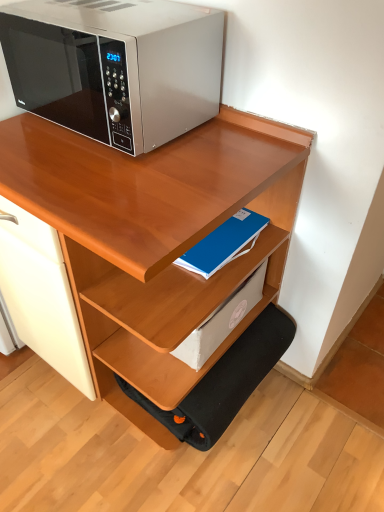
What is the approximate width of blue matte notebook at center, the 1th paperback book viewed from the top?

The width of blue matte notebook at center, the 1th paperback book viewed from the top, is 13.20 inches.

What do you see at coordinates (225, 381) in the screenshot? This screenshot has width=384, height=512. I see `black fabric step stool at lower center` at bounding box center [225, 381].

At what (x,y) coordinates should I click in order to perform the action: click on black fabric step stool at lower center. Please return your answer as a coordinate pair (x, y). This screenshot has height=512, width=384. Looking at the image, I should click on (225, 381).

What is the approximate width of wooden desk at upper center?

Answer: wooden desk at upper center is 24.09 inches wide.

Where is `blue matte paper at center, acting as the 1th paperback book starting from the bottom`? The height and width of the screenshot is (512, 384). blue matte paper at center, acting as the 1th paperback book starting from the bottom is located at coordinates (221, 321).

Which point is more distant from viewer, (259,381) or (118,203)?

The point (259,381) is farther.

Is black fabric step stool at lower center not near wooden desk at upper center?

No, black fabric step stool at lower center is in close proximity to wooden desk at upper center.

Consider the image. Considering the relative positions of black fabric step stool at lower center and wooden desk at upper center in the image provided, is black fabric step stool at lower center to the left of wooden desk at upper center from the viewer's perspective?

No, black fabric step stool at lower center is not to the left of wooden desk at upper center.

From the image's perspective, which one is positioned higher, blue matte notebook at center, the 1th paperback book viewed from the top, or satin silver microwave at upper left?

satin silver microwave at upper left is shown above in the image.

Considering the relative positions of blue matte notebook at center, positioned as the second paperback book in bottom-to-top order, and satin silver microwave at upper left in the image provided, is blue matte notebook at center, positioned as the second paperback book in bottom-to-top order, to the left of satin silver microwave at upper left from the viewer's perspective?

Incorrect, blue matte notebook at center, positioned as the second paperback book in bottom-to-top order, is not on the left side of satin silver microwave at upper left.

Is point (240, 217) behind point (208, 114)?

Yes.

From a real-world perspective, does blue matte notebook at center, positioned as the second paperback book in bottom-to-top order, sit lower than satin silver microwave at upper left?

Correct, in the physical world, blue matte notebook at center, positioned as the second paperback book in bottom-to-top order, is lower than satin silver microwave at upper left.

Do you think satin silver microwave at upper left is within black fabric step stool at lower center, or outside of it?

satin silver microwave at upper left is not enclosed by black fabric step stool at lower center.

From a real-world perspective, is satin silver microwave at upper left physically located above or below black fabric step stool at lower center?

Clearly, from a real-world perspective, satin silver microwave at upper left is above black fabric step stool at lower center.

Could you measure the distance between satin silver microwave at upper left and black fabric step stool at lower center?

satin silver microwave at upper left is 30.51 inches from black fabric step stool at lower center.

Is satin silver microwave at upper left facing towards black fabric step stool at lower center?

No, satin silver microwave at upper left does not turn towards black fabric step stool at lower center.

Can you confirm if black fabric step stool at lower center is thinner than blue matte paper at center, the second paperback book when ordered from top to bottom?

No.

Considering the positions of objects black fabric step stool at lower center and blue matte paper at center, acting as the 1th paperback book starting from the bottom, in the image provided, who is behind, black fabric step stool at lower center or blue matte paper at center, acting as the 1th paperback book starting from the bottom,?

black fabric step stool at lower center is further from the camera.

Image resolution: width=384 pixels, height=512 pixels. I want to click on paperback book that is the 1st object located above the black fabric step stool at lower center (from the image's perspective), so click(221, 321).

From the image's perspective, is black fabric step stool at lower center located beneath blue matte paper at center, acting as the 1th paperback book starting from the bottom?

Yes, from the image's perspective, black fabric step stool at lower center is below blue matte paper at center, acting as the 1th paperback book starting from the bottom.

Considering the points (247, 283) and (203, 424), which point is behind, point (247, 283) or point (203, 424)?

The point (247, 283) is farther.

From a real-world perspective, who is located lower, blue matte paper at center, the second paperback book when ordered from top to bottom, or black fabric step stool at lower center?

From a 3D spatial view, black fabric step stool at lower center is below.

Is blue matte paper at center, acting as the 1th paperback book starting from the bottom, oriented away from black fabric step stool at lower center?

No, blue matte paper at center, acting as the 1th paperback book starting from the bottom,'s orientation is not away from black fabric step stool at lower center.

Who is shorter, blue matte paper at center, acting as the 1th paperback book starting from the bottom, or blue matte notebook at center, the 1th paperback book viewed from the top?

blue matte notebook at center, the 1th paperback book viewed from the top.

From the image's perspective, which one is positioned lower, blue matte paper at center, acting as the 1th paperback book starting from the bottom, or blue matte notebook at center, positioned as the second paperback book in bottom-to-top order?

From the image's view, blue matte paper at center, acting as the 1th paperback book starting from the bottom, is below.

Can you confirm if blue matte paper at center, the second paperback book when ordered from top to bottom, is wider than blue matte notebook at center, positioned as the second paperback book in bottom-to-top order?

In fact, blue matte paper at center, the second paperback book when ordered from top to bottom, might be narrower than blue matte notebook at center, positioned as the second paperback book in bottom-to-top order.

In the image, is blue matte paper at center, acting as the 1th paperback book starting from the bottom, on the left side or the right side of blue matte notebook at center, the 1th paperback book viewed from the top?

Clearly, blue matte paper at center, acting as the 1th paperback book starting from the bottom, is on the right of blue matte notebook at center, the 1th paperback book viewed from the top, in the image.

Is satin silver microwave at upper left thinner than wooden desk at upper center?

Yes, satin silver microwave at upper left is thinner than wooden desk at upper center.

Is satin silver microwave at upper left in front of wooden desk at upper center?

No, satin silver microwave at upper left is behind wooden desk at upper center.

Is satin silver microwave at upper left looking in the opposite direction of wooden desk at upper center?

No, satin silver microwave at upper left is not facing away from wooden desk at upper center.

From the image's perspective, is satin silver microwave at upper left located above or below wooden desk at upper center?

Clearly, from the image's perspective, satin silver microwave at upper left is above wooden desk at upper center.

Find the location of a particular element. step stool below the wooden desk at upper center (from a real-world perspective) is located at coordinates (225, 381).

This screenshot has width=384, height=512. In order to click on paperback book that is the 1st object located below the satin silver microwave at upper left (from the image's perspective) in this screenshot , I will do `click(224, 243)`.

Which object lies nearer to the anchor point black fabric step stool at lower center, wooden desk at upper center or blue matte notebook at center, positioned as the second paperback book in bottom-to-top order?

Based on the image, wooden desk at upper center appears to be nearer to black fabric step stool at lower center.

Which object lies further to the anchor point blue matte paper at center, acting as the 1th paperback book starting from the bottom, satin silver microwave at upper left or black fabric step stool at lower center?

The object further to blue matte paper at center, acting as the 1th paperback book starting from the bottom, is satin silver microwave at upper left.

In the scene shown: From the image, which object appears to be farther from satin silver microwave at upper left, blue matte notebook at center, the 1th paperback book viewed from the top, or wooden desk at upper center?

blue matte notebook at center, the 1th paperback book viewed from the top, is further to satin silver microwave at upper left.

Estimate the real-world distances between objects in this image. Which object is further from wooden desk at upper center, black fabric step stool at lower center or blue matte notebook at center, positioned as the second paperback book in bottom-to-top order?

black fabric step stool at lower center lies further to wooden desk at upper center than the other object.

Looking at the image, which one is located further to blue matte paper at center, the second paperback book when ordered from top to bottom, black fabric step stool at lower center or wooden desk at upper center?

wooden desk at upper center is positioned further to the anchor blue matte paper at center, the second paperback book when ordered from top to bottom.

Considering their positions, is satin silver microwave at upper left positioned closer to black fabric step stool at lower center than blue matte notebook at center, the 1th paperback book viewed from the top?

blue matte notebook at center, the 1th paperback book viewed from the top, is positioned closer to the anchor black fabric step stool at lower center.

Based on the photo, estimate the real-world distances between objects in this image. Which object is further from satin silver microwave at upper left, blue matte paper at center, the second paperback book when ordered from top to bottom, or wooden desk at upper center?

blue matte paper at center, the second paperback book when ordered from top to bottom, is positioned further to the anchor satin silver microwave at upper left.

Based on the photo, considering their positions, is wooden desk at upper center positioned closer to satin silver microwave at upper left than black fabric step stool at lower center?

The object closer to satin silver microwave at upper left is wooden desk at upper center.

Locate an element on the screen. The image size is (384, 512). paperback book between satin silver microwave at upper left and wooden desk at upper center from top to bottom is located at coordinates (224, 243).

Identify the location of paperback book between blue matte notebook at center, positioned as the second paperback book in bottom-to-top order, and black fabric step stool at lower center in the up-down direction. (221, 321).

Image resolution: width=384 pixels, height=512 pixels. I want to click on paperback book between satin silver microwave at upper left and blue matte paper at center, acting as the 1th paperback book starting from the bottom, in the up-down direction, so 224,243.

Identify the location of desk between satin silver microwave at upper left and black fabric step stool at lower center in the up-down direction. coord(155,239).